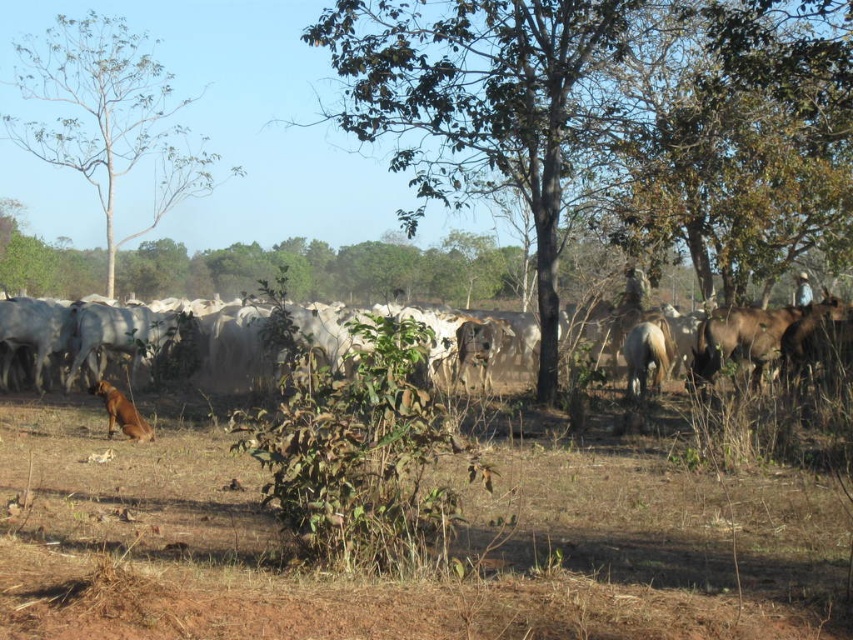
Question: From the image, what is the correct spatial relationship of brown dry soil at lower center in relation to white matte cows at left?

Choices:
 (A) above
 (B) below

Answer: (B)

Question: Which of the following is the closest to the observer?

Choices:
 (A) green leafy tree at upper left
 (B) white matte cows at left
 (C) brown fur dog at lower left

Answer: (C)

Question: Is green leafy tree at upper left to the left of brown fur dog at lower left from the viewer's perspective?

Choices:
 (A) yes
 (B) no

Answer: (A)

Question: Which is farther from the white matte cows at left?

Choices:
 (A) green leafy tree at center
 (B) green leafy tree at upper left

Answer: (B)

Question: Which object is positioned closest to the brown dry soil at lower center?

Choices:
 (A) brown fur dog at lower left
 (B) green leafy tree at upper left

Answer: (A)

Question: Is brown dry soil at lower center to the right of green leafy tree at center from the viewer's perspective?

Choices:
 (A) yes
 (B) no

Answer: (B)